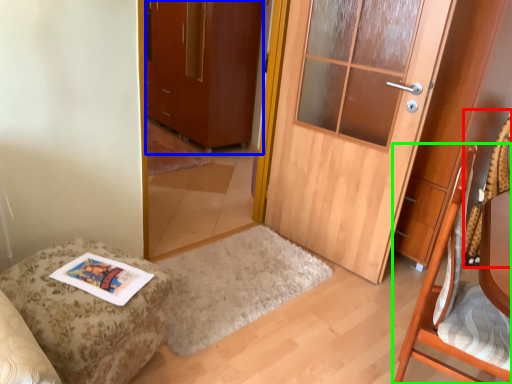
Question: Estimate the real-world distances between objects in this image. Which object is closer to swivel chair (highlighted by a red box), cabinetry (highlighted by a blue box) or chair (highlighted by a green box)?

Choices:
 (A) cabinetry
 (B) chair

Answer: (B)